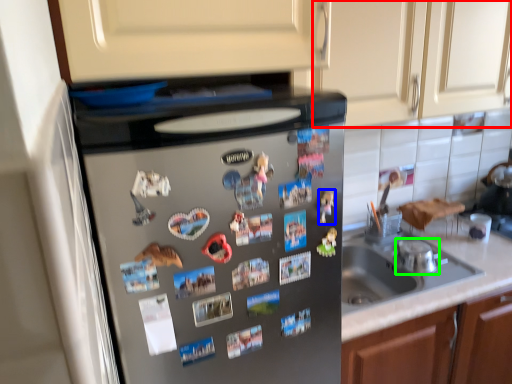
Question: Considering the real-world distances, which object is farthest from cabinetry (highlighted by a red box)? toy (highlighted by a blue box) or appliance (highlighted by a green box)?

Choices:
 (A) toy
 (B) appliance

Answer: (A)